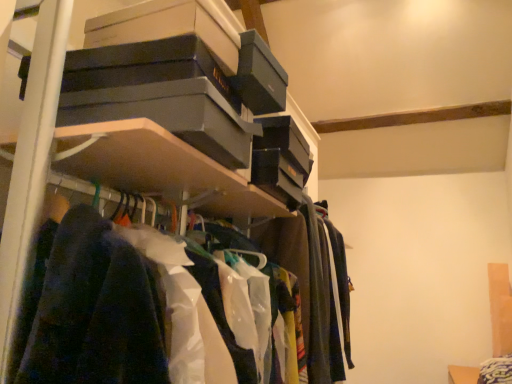
This screenshot has height=384, width=512. What do you see at coordinates (131, 308) in the screenshot?
I see `polyester shirts at center` at bounding box center [131, 308].

Measure the distance between polyester shirts at center and camera.

22.63 inches.

You are a GUI agent. You are given a task and a screenshot of the screen. Output one action in this format:
    pyautogui.click(x=<x>, y=<y>)
    Task: Click on the polyester shirts at center
    
    Given the screenshot: What is the action you would take?
    pyautogui.click(x=131, y=308)

I want to click on matte black boxes at upper center, so [x=91, y=313].

What do you see at coordinates (91, 313) in the screenshot?
I see `matte black boxes at upper center` at bounding box center [91, 313].

The width and height of the screenshot is (512, 384). In order to click on polyester shirts at center in this screenshot , I will do `click(131, 308)`.

Would you say polyester shirts at center is to the left or to the right of matte black boxes at upper center in the picture?

Clearly, polyester shirts at center is on the left of matte black boxes at upper center in the image.

Which object is further away from the camera taking this photo, polyester shirts at center or matte black boxes at upper center?

matte black boxes at upper center is further from the camera.

Which point is more forward, (70, 324) or (92, 249)?

The point (70, 324) is closer to the camera.

From the image's perspective, is polyester shirts at center above or below matte black boxes at upper center?

From the image's perspective, polyester shirts at center appears above matte black boxes at upper center.

From a real-world perspective, does polyester shirts at center stand above matte black boxes at upper center?

No, from a real-world perspective, polyester shirts at center is not over matte black boxes at upper center

Is polyester shirts at center wider than matte black boxes at upper center?

No, polyester shirts at center is not wider than matte black boxes at upper center.

Is polyester shirts at center shorter than matte black boxes at upper center?

Yes, polyester shirts at center is shorter than matte black boxes at upper center.

Does polyester shirts at center have a larger size compared to matte black boxes at upper center?

No.

Is polyester shirts at center positioned beyond the bounds of matte black boxes at upper center?

No, polyester shirts at center is not outside of matte black boxes at upper center.

In the scene shown: Is polyester shirts at center not near matte black boxes at upper center?

That's not correct — polyester shirts at center is a little close to matte black boxes at upper center.

Is polyester shirts at center positioned with its back to matte black boxes at upper center?

Yes.

You are a GUI agent. You are given a task and a screenshot of the screen. Output one action in this format:
    pyautogui.click(x=<x>, y=<y>)
    Task: Click on the clothing above the matte black boxes at upper center (from the image's perspective)
    
    Given the screenshot: What is the action you would take?
    pos(131,308)

Between matte black boxes at upper center and polyester shirts at center, which one appears on the left side from the viewer's perspective?

From the viewer's perspective, polyester shirts at center appears more on the left side.

Is matte black boxes at upper center in front of or behind polyester shirts at center in the image?

matte black boxes at upper center is positioned farther from the viewer than polyester shirts at center.

Which point is more forward, (94, 313) or (94, 346)?

The point (94, 346) is more forward.

From the image's perspective, is matte black boxes at upper center on polyester shirts at center?

No, from the image's perspective, matte black boxes at upper center is not above polyester shirts at center.

From a real-world perspective, between matte black boxes at upper center and polyester shirts at center, who is vertically lower?

From a 3D spatial view, polyester shirts at center is below.

From the picture: Which object is thinner, matte black boxes at upper center or polyester shirts at center?

Thinner between the two is polyester shirts at center.

Considering the relative sizes of matte black boxes at upper center and polyester shirts at center in the image provided, is matte black boxes at upper center taller than polyester shirts at center?

Indeed, matte black boxes at upper center has a greater height compared to polyester shirts at center.

Which of these two, matte black boxes at upper center or polyester shirts at center, is smaller?

With smaller size is polyester shirts at center.

Is polyester shirts at center inside matte black boxes at upper center?

Yes, matte black boxes at upper center contains polyester shirts at center.

From the picture: Would you consider matte black boxes at upper center to be distant from polyester shirts at center?

No, matte black boxes at upper center is in close proximity to polyester shirts at center.

Is matte black boxes at upper center turned away from polyester shirts at center?

Yes, matte black boxes at upper center is facing away from polyester shirts at center.

How far apart are matte black boxes at upper center and polyester shirts at center?

matte black boxes at upper center is 17.46 centimeters from polyester shirts at center.

This screenshot has height=384, width=512. Identify the location of shelf above the polyester shirts at center (from a real-world perspective). (91, 313).

At what (x,y) coordinates should I click in order to perform the action: click on shelf behind the polyester shirts at center. Please return your answer as a coordinate pair (x, y). The width and height of the screenshot is (512, 384). Looking at the image, I should click on (91, 313).

At what (x,y) coordinates should I click in order to perform the action: click on shelf on the right of polyester shirts at center. Please return your answer as a coordinate pair (x, y). This screenshot has width=512, height=384. Looking at the image, I should click on (91, 313).